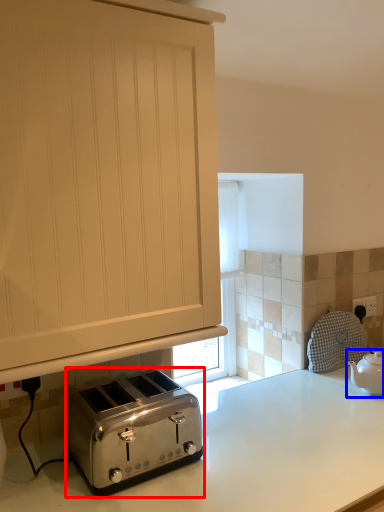
Question: Which object appears closest to the camera in this image, toaster (highlighted by a red box) or tea pot (highlighted by a blue box)?

Choices:
 (A) toaster
 (B) tea pot

Answer: (A)